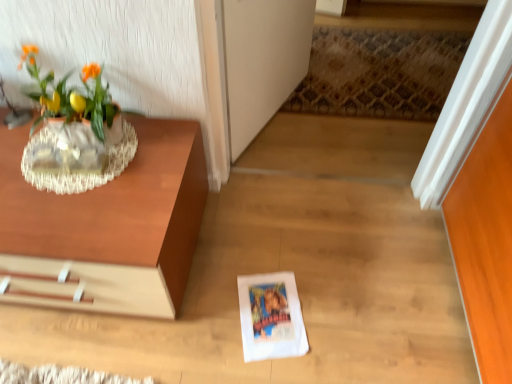
Question: Is white paper at center at the left side of wooden table at left?

Choices:
 (A) no
 (B) yes

Answer: (A)

Question: Could wooden table at left be considered to be inside white paper at center?

Choices:
 (A) yes
 (B) no

Answer: (B)

Question: Does white paper at center come behind wooden table at left?

Choices:
 (A) no
 (B) yes

Answer: (B)

Question: Can you confirm if white paper at center is smaller than wooden table at left?

Choices:
 (A) yes
 (B) no

Answer: (A)

Question: From a real-world perspective, is white paper at center on top of wooden table at left?

Choices:
 (A) yes
 (B) no

Answer: (B)

Question: From the image's perspective, is white paper at center positioned above or below transparent glass door at center?

Choices:
 (A) above
 (B) below

Answer: (B)

Question: Considering the positions of point (244, 316) and point (267, 16), is point (244, 316) closer or farther from the camera than point (267, 16)?

Choices:
 (A) farther
 (B) closer

Answer: (B)

Question: Considering the positions of white paper at center and transparent glass door at center in the image, is white paper at center bigger or smaller than transparent glass door at center?

Choices:
 (A) small
 (B) big

Answer: (A)

Question: From a real-world perspective, is white paper at center physically located above or below transparent glass door at center?

Choices:
 (A) below
 (B) above

Answer: (A)

Question: Considering the positions of transparent glass door at center and clear glass vase at upper left in the image, is transparent glass door at center wider or thinner than clear glass vase at upper left?

Choices:
 (A) thin
 (B) wide

Answer: (A)

Question: In the image, is transparent glass door at center positioned in front of or behind clear glass vase at upper left?

Choices:
 (A) behind
 (B) front

Answer: (A)

Question: Looking at the image, does transparent glass door at center seem bigger or smaller compared to clear glass vase at upper left?

Choices:
 (A) small
 (B) big

Answer: (B)

Question: Would you say transparent glass door at center is to the left or to the right of clear glass vase at upper left in the picture?

Choices:
 (A) right
 (B) left

Answer: (A)

Question: In terms of size, does white paper at center appear bigger or smaller than matte glass vase at upper left?

Choices:
 (A) big
 (B) small

Answer: (B)

Question: Considering their positions, is white paper at center located in front of or behind matte glass vase at upper left?

Choices:
 (A) behind
 (B) front

Answer: (A)